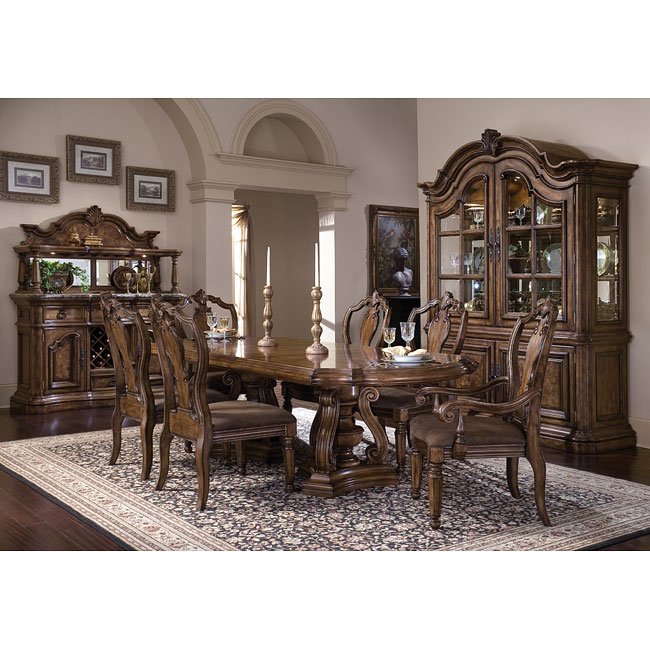
The height and width of the screenshot is (650, 650). I want to click on chairs, so click(238, 430), click(161, 398), click(457, 429), click(435, 335), click(379, 320), click(209, 304).